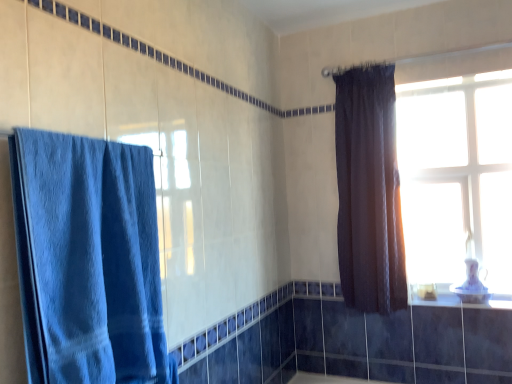
Question: Is dark matte curtain at upper right, placed as the first curtain when sorted from back to front, oriented towards white glossy sink at upper right?

Choices:
 (A) yes
 (B) no

Answer: (B)

Question: From a real-world perspective, is dark matte curtain at upper right, which is counted as the 1th curtain, starting from the right, physically below white glossy sink at upper right?

Choices:
 (A) yes
 (B) no

Answer: (B)

Question: From a real-world perspective, does dark matte curtain at upper right, placed as the first curtain when sorted from back to front, stand above white glossy sink at upper right?

Choices:
 (A) yes
 (B) no

Answer: (A)

Question: Does dark matte curtain at upper right, placed as the first curtain when sorted from back to front, have a smaller size compared to white glossy sink at upper right?

Choices:
 (A) no
 (B) yes

Answer: (A)

Question: Is dark matte curtain at upper right, placed as the first curtain when sorted from back to front, wider than white glossy sink at upper right?

Choices:
 (A) no
 (B) yes

Answer: (B)

Question: Is the depth of dark matte curtain at upper right, placed as the first curtain when sorted from back to front, less than that of white glossy sink at upper right?

Choices:
 (A) yes
 (B) no

Answer: (A)

Question: Considering the relative positions of white glossy sink at upper right and blue towel at left, arranged as the second curtain when viewed from the back, in the image provided, is white glossy sink at upper right to the left of blue towel at left, arranged as the second curtain when viewed from the back, from the viewer's perspective?

Choices:
 (A) no
 (B) yes

Answer: (A)

Question: Can you confirm if white glossy sink at upper right is wider than blue towel at left, acting as the second curtain starting from the right?

Choices:
 (A) no
 (B) yes

Answer: (A)

Question: Is white glossy sink at upper right located outside blue towel at left, the first curtain when ordered from front to back?

Choices:
 (A) yes
 (B) no

Answer: (A)

Question: Does white glossy sink at upper right lie in front of blue towel at left, the first curtain when ordered from front to back?

Choices:
 (A) no
 (B) yes

Answer: (A)

Question: Is white glossy sink at upper right oriented away from blue towel at left, the first curtain when ordered from front to back?

Choices:
 (A) yes
 (B) no

Answer: (B)

Question: Does white glossy sink at upper right appear on the right side of blue towel at left, the 1th curtain from the left?

Choices:
 (A) no
 (B) yes

Answer: (B)

Question: Is porcelain white window sill at lower right at the left side of blue towel at left, arranged as the second curtain when viewed from the back?

Choices:
 (A) no
 (B) yes

Answer: (A)